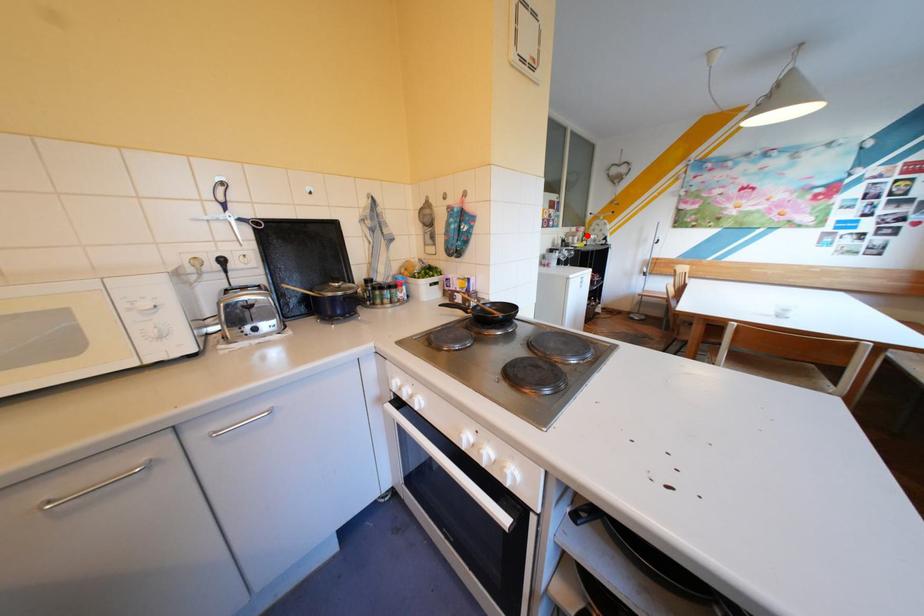
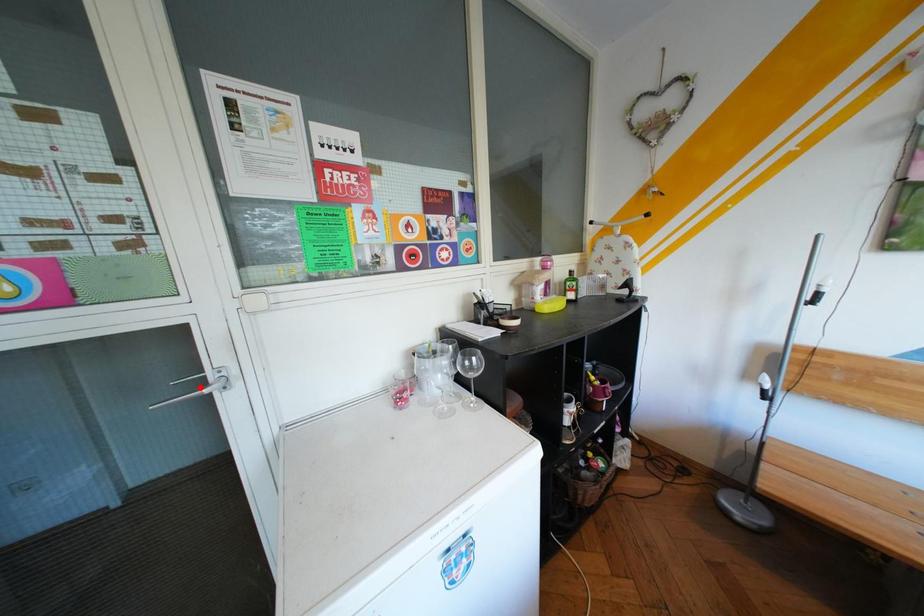
I am providing you with two images of the same scene from different viewpoints. A red point is marked on the first image and another point is marked on the second image. Does the point marked in image1 correspond to the same location as the one in image2?

No